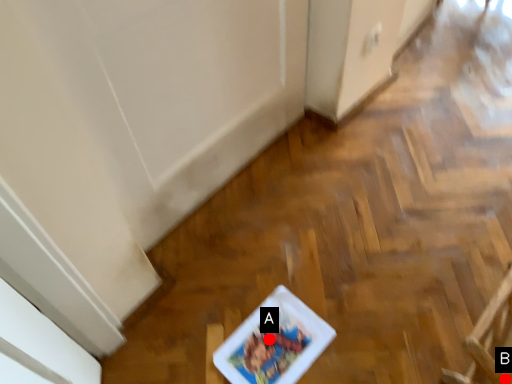
Question: Two points are circled on the image, labeled by A and B beside each circle. Which of the following is the closest to the observer?

Choices:
 (A) A is closer
 (B) B is closer

Answer: (B)